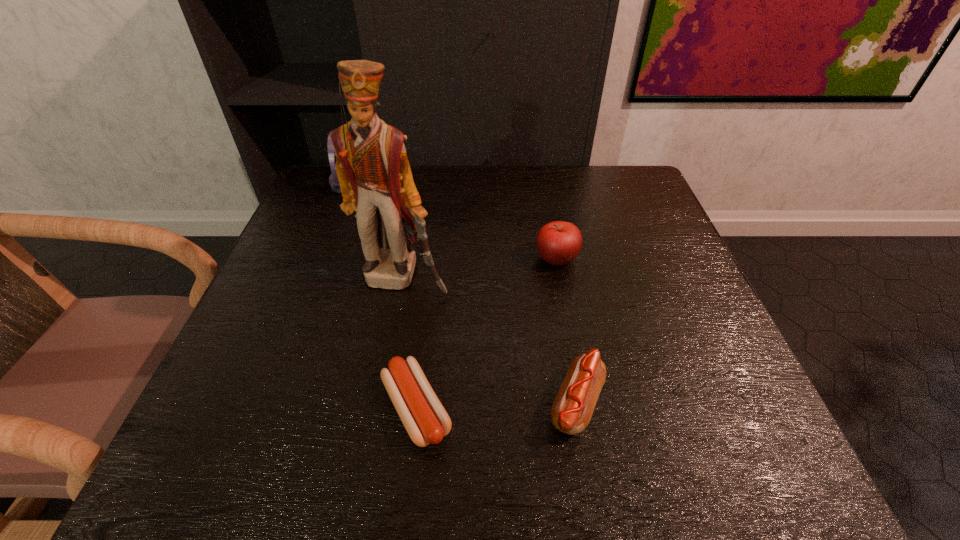
In the image, there is a desktop. Where is `vacant space at the far right corner`? vacant space at the far right corner is located at coordinates (597, 192).

I want to click on empty space between the nutcracker and the third tallest object, so click(480, 269).

Identify the location of vacant space that's between the tallest object and the right sausage. The width and height of the screenshot is (960, 540). (490, 341).

Locate an element on the screen. The height and width of the screenshot is (540, 960). vacant point located between the third shortest object and the shorter sausage is located at coordinates (487, 334).

You are a GUI agent. You are given a task and a screenshot of the screen. Output one action in this format:
    pyautogui.click(x=<x>, y=<y>)
    Task: Click on the vacant area that lies between the left sausage and the nutcracker
    Image resolution: width=960 pixels, height=540 pixels.
    Given the screenshot: What is the action you would take?
    pyautogui.click(x=410, y=343)

Locate an element on the screen. free point between the second shortest object and the second tallest object is located at coordinates (462, 295).

The height and width of the screenshot is (540, 960). I want to click on free space between the leftmost object and the apple, so click(451, 222).

You are a GUI agent. You are given a task and a screenshot of the screen. Output one action in this format:
    pyautogui.click(x=<x>, y=<y>)
    Task: Click on the free space that is in between the headset and the apple
    
    Given the screenshot: What is the action you would take?
    pyautogui.click(x=451, y=222)

Find the location of a particular element. Image resolution: width=960 pixels, height=540 pixels. unoccupied position between the right sausage and the apple is located at coordinates (566, 332).

The width and height of the screenshot is (960, 540). I want to click on vacant space that is in between the tallest object and the taller sausage, so click(490, 341).